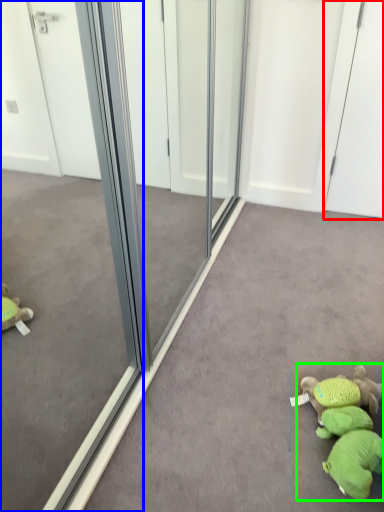
Question: Based on their relative distances, which object is nearer to screen door (highlighted by a red box)? Choose from glass door (highlighted by a blue box) and toy (highlighted by a green box).

Choices:
 (A) glass door
 (B) toy

Answer: (B)